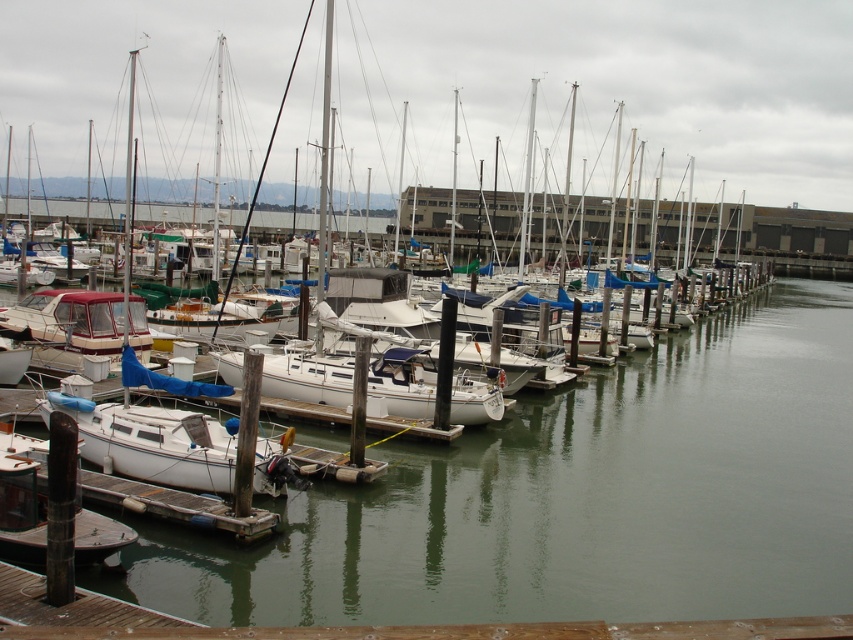
You are standing on the dock and looking towards the clear water at center and the white matte sailboat at lower left. Which object is closer to you?

The clear water at center is closer to you because it is positioned in front of the white matte sailboat at lower left.

You are standing on the wooden pier and see the clear water at center and the white matte sailboat at lower left. Which object is closer to your right side?

The clear water at center is closer to your right side because it is positioned to the right of the white matte sailboat at lower left.